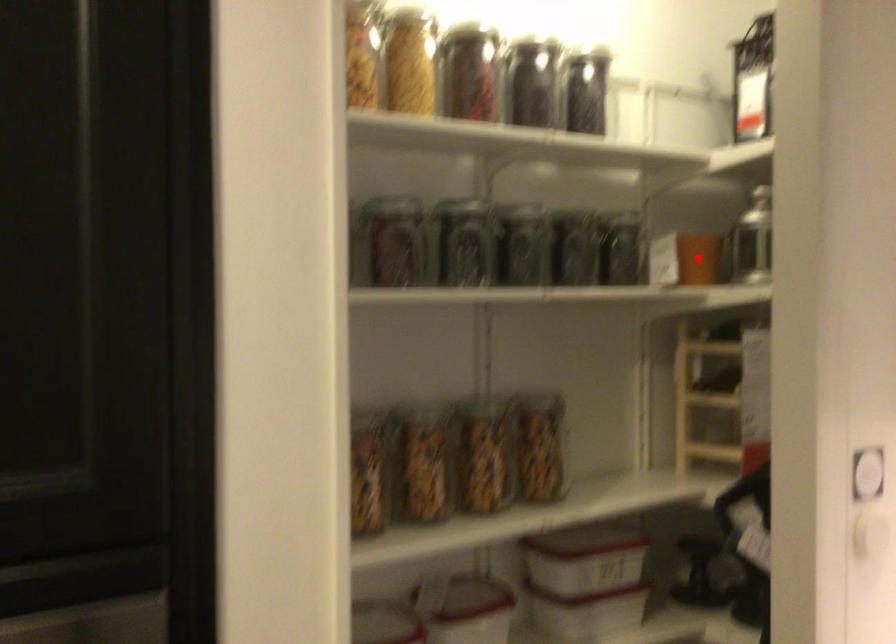
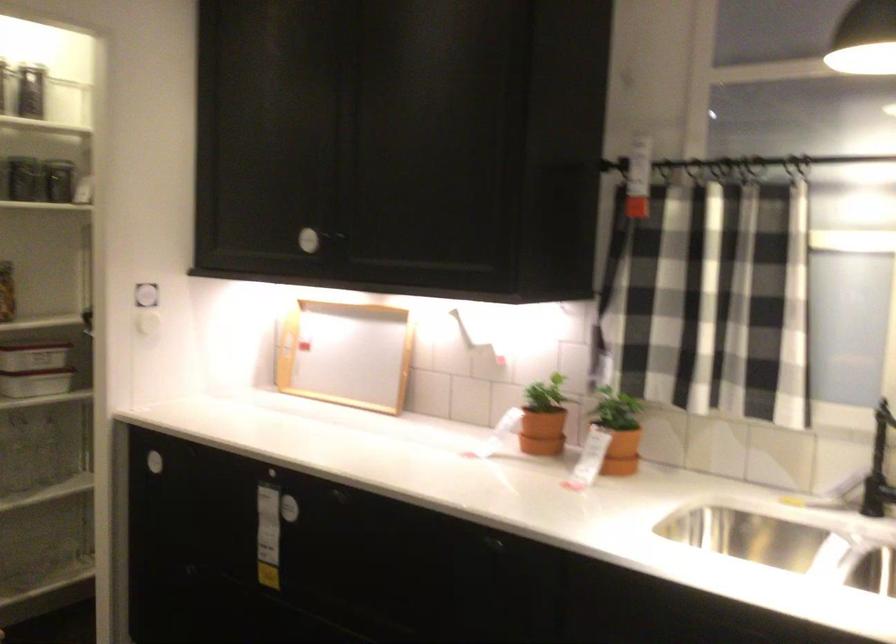
Question: I am providing you with two images of the same scene from different viewpoints. A red point is marked on the first image. Is the red point's position out of view in image 2?

Choices:
 (A) Yes
 (B) No

Answer: (A)